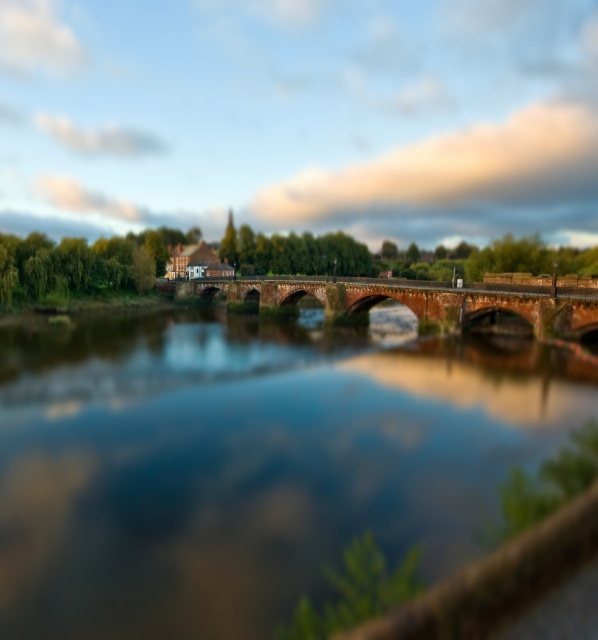
In the scene shown: Can you confirm if brown stone bridge at center is thinner than red brick bridge at center?

In fact, brown stone bridge at center might be wider than red brick bridge at center.

Who is more forward, (407, 340) or (566, 333)?

Point (566, 333) is more forward.

The image size is (598, 640). In order to click on brown stone bridge at center in this screenshot , I will do `click(251, 460)`.